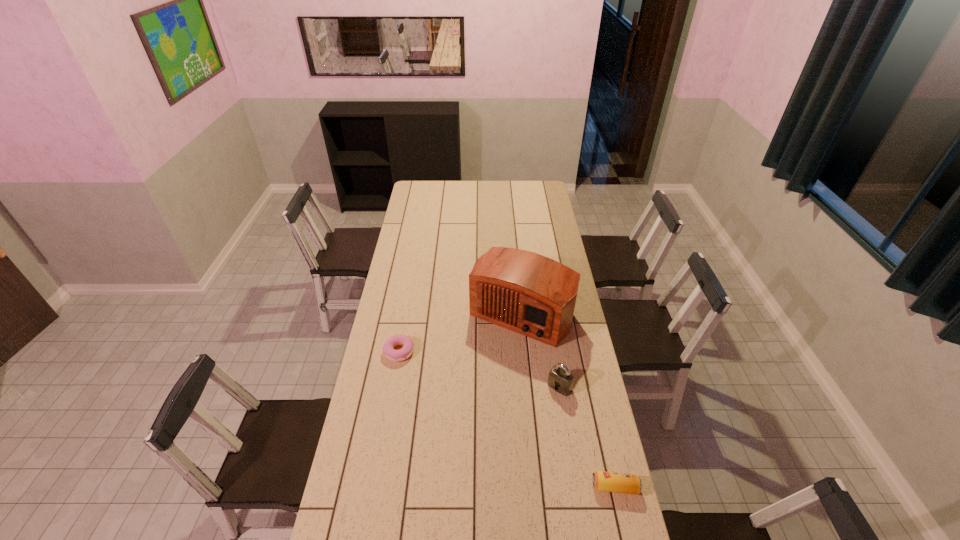
Where is `empty space that is in between the padlock and the radio receiver`? empty space that is in between the padlock and the radio receiver is located at coordinates (540, 350).

The height and width of the screenshot is (540, 960). In order to click on empty location between the leftmost object and the second tallest object in this screenshot , I will do `click(479, 369)`.

The image size is (960, 540). I want to click on unoccupied area between the pastry and the second shortest object, so click(x=507, y=419).

Identify which object is the second nearest to the third tallest object. Please provide its 2D coordinates. Your answer should be formatted as a tuple, i.e. [(x, y)], where the tuple contains the x and y coordinates of a point satisfying the conditions above.

[(525, 292)]

Choose which object is the nearest neighbor to the third tallest object. Please provide its 2D coordinates. Your answer should be formatted as a tuple, i.e. [(x, y)], where the tuple contains the x and y coordinates of a point satisfying the conditions above.

[(560, 379)]

The height and width of the screenshot is (540, 960). I want to click on vacant space that satisfies the following two spatial constraints: 1. on the front side of the pastry; 2. on the left side of the third farthest object, so click(x=393, y=387).

Find the location of a particular element. The image size is (960, 540). free spot that satisfies the following two spatial constraints: 1. on the front side of the shortest object; 2. on the left side of the second shortest object is located at coordinates (375, 487).